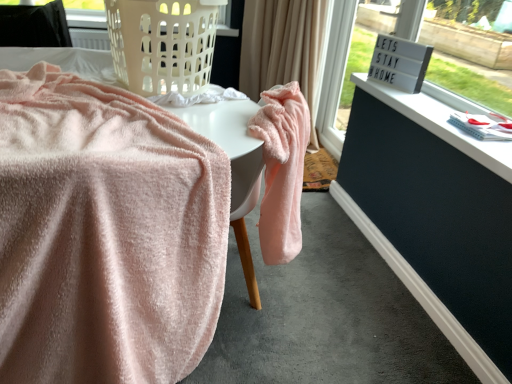
This screenshot has height=384, width=512. I want to click on free space above dark blue painted wood dresser at lower right (from a real-world perspective), so click(x=398, y=262).